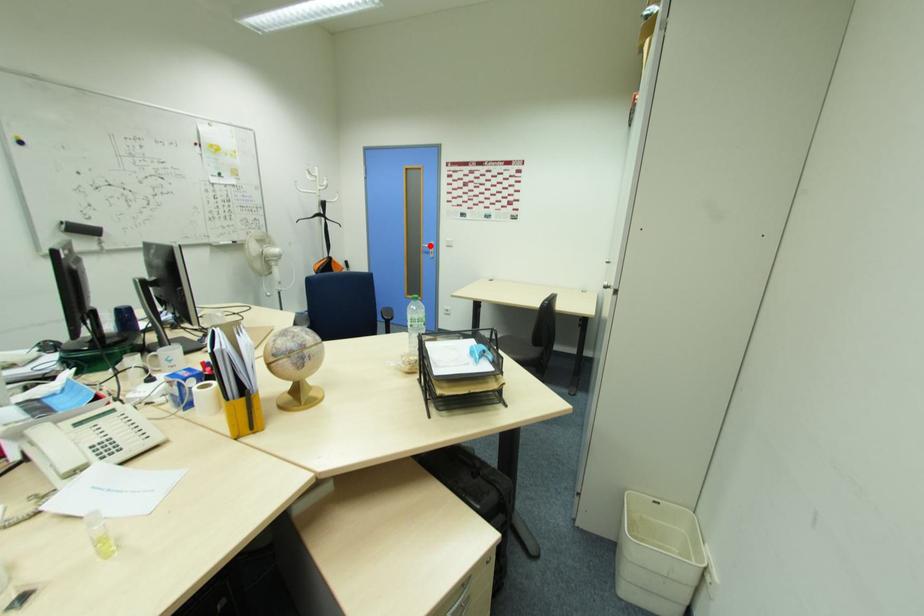
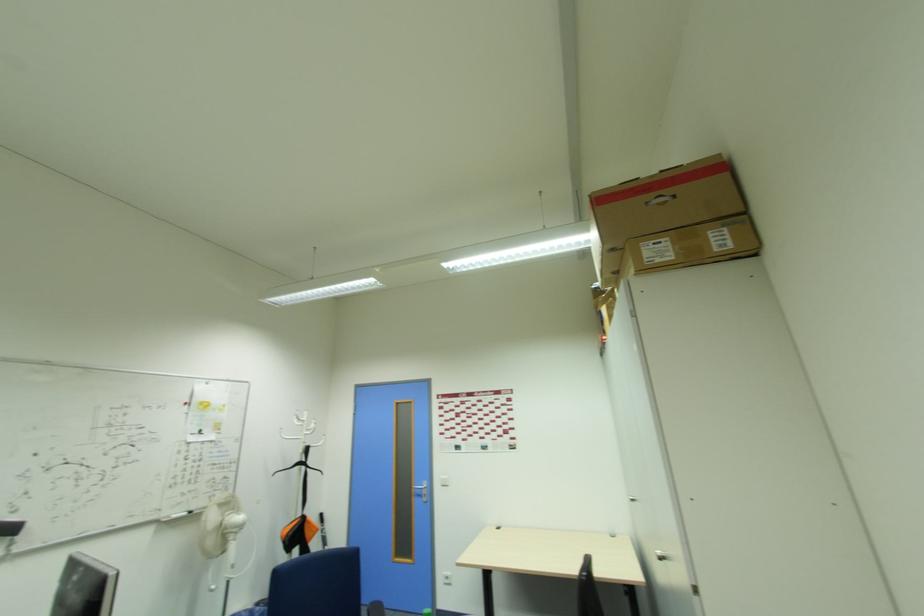
Question: I am providing you with two images of the same scene from different viewpoints. A red point is marked on the first image. Is the red point's position out of view in image 2?

Choices:
 (A) Yes
 (B) No

Answer: (B)